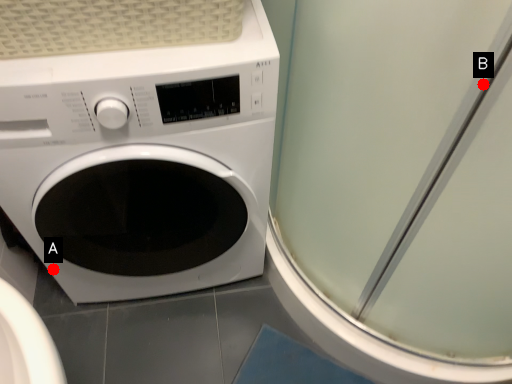
Question: Two points are circled on the image, labeled by A and B beside each circle. Among these points, which one is nearest to the camera?

Choices:
 (A) A is closer
 (B) B is closer

Answer: (B)